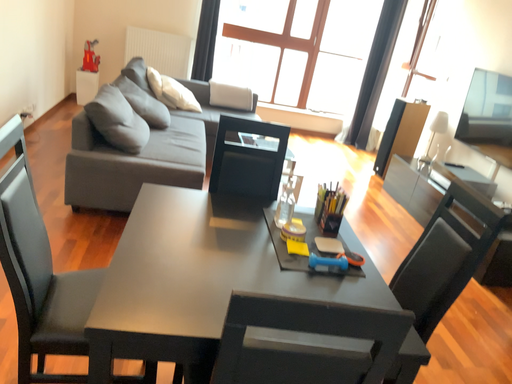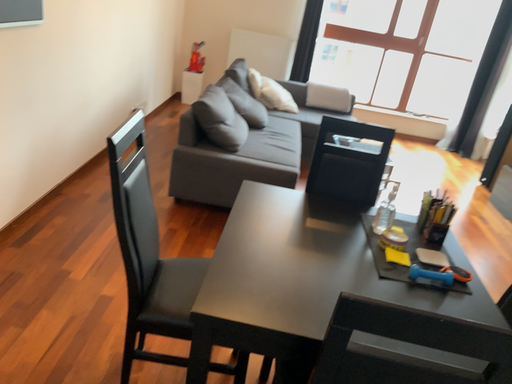
Question: How did the camera likely rotate when shooting the video?

Choices:
 (A) rotated left
 (B) rotated right

Answer: (A)